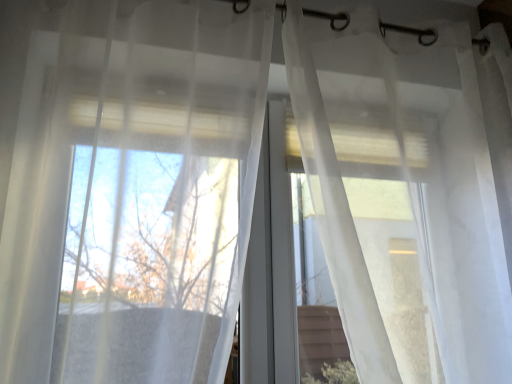
Question: Is there a large distance between translucent white curtain at center, the first curtain in the right-to-left sequence, and translucent white curtain at center, which ranks as the 2th curtain in right-to-left order?

Choices:
 (A) no
 (B) yes

Answer: (A)

Question: From the image's perspective, is translucent white curtain at center, the first curtain in the right-to-left sequence, located beneath translucent white curtain at center, which ranks as the 2th curtain in right-to-left order?

Choices:
 (A) yes
 (B) no

Answer: (A)

Question: Does translucent white curtain at center, which ranks as the 2th curtain in left-to-right order, have a greater height compared to translucent white curtain at center, the 1th curtain from the left?

Choices:
 (A) yes
 (B) no

Answer: (A)

Question: Is translucent white curtain at center, which ranks as the 2th curtain in left-to-right order, placed right next to translucent white curtain at center, the 1th curtain from the left?

Choices:
 (A) yes
 (B) no

Answer: (B)

Question: Is translucent white curtain at center, which ranks as the 2th curtain in left-to-right order, thinner than translucent white curtain at center, the 1th curtain from the left?

Choices:
 (A) yes
 (B) no

Answer: (A)

Question: From the image's perspective, is translucent white curtain at center, the first curtain in the right-to-left sequence, on top of translucent white curtain at center, which ranks as the 2th curtain in right-to-left order?

Choices:
 (A) no
 (B) yes

Answer: (A)

Question: Is translucent white curtain at center, which ranks as the 2th curtain in right-to-left order, not inside translucent white curtain at center, which ranks as the 2th curtain in left-to-right order?

Choices:
 (A) no
 (B) yes

Answer: (B)

Question: Is translucent white curtain at center, the 1th curtain from the left, oriented away from translucent white curtain at center, which ranks as the 2th curtain in left-to-right order?

Choices:
 (A) no
 (B) yes

Answer: (A)

Question: From a real-world perspective, is translucent white curtain at center, which ranks as the 2th curtain in right-to-left order, positioned over translucent white curtain at center, the first curtain in the right-to-left sequence, based on gravity?

Choices:
 (A) no
 (B) yes

Answer: (B)

Question: From the image's perspective, is translucent white curtain at center, the 1th curtain from the left, over translucent white curtain at center, the first curtain in the right-to-left sequence?

Choices:
 (A) no
 (B) yes

Answer: (B)

Question: Does translucent white curtain at center, the 1th curtain from the left, have a larger size compared to translucent white curtain at center, the first curtain in the right-to-left sequence?

Choices:
 (A) yes
 (B) no

Answer: (B)

Question: Does translucent white curtain at center, the 1th curtain from the left, appear on the left side of translucent white curtain at center, the first curtain in the right-to-left sequence?

Choices:
 (A) yes
 (B) no

Answer: (A)

Question: From the image's perspective, is translucent white curtain at center, the 1th curtain from the left, positioned above or below translucent white curtain at center, the first curtain in the right-to-left sequence?

Choices:
 (A) below
 (B) above

Answer: (B)